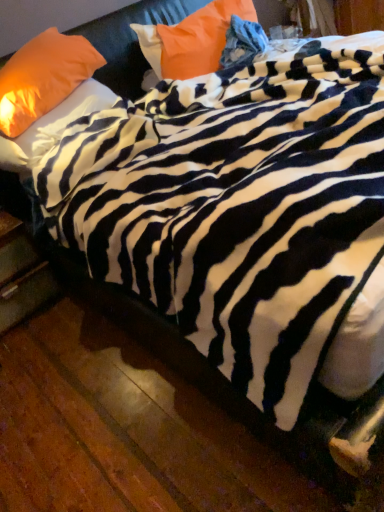
Question: Can you confirm if orange fabric pillow at upper left, the 1th pillow viewed from the left, is shorter than matte orange pillow at upper left, marked as the second pillow in a left-to-right arrangement?

Choices:
 (A) yes
 (B) no

Answer: (B)

Question: From a real-world perspective, is orange fabric pillow at upper left, the 1th pillow viewed from the left, physically below matte orange pillow at upper left, which is the 2th pillow from right to left?

Choices:
 (A) yes
 (B) no

Answer: (B)

Question: Considering the relative positions of orange fabric pillow at upper left, which is counted as the third pillow, starting from the right, and matte orange pillow at upper left, marked as the second pillow in a left-to-right arrangement, in the image provided, is orange fabric pillow at upper left, which is counted as the third pillow, starting from the right, to the right of matte orange pillow at upper left, marked as the second pillow in a left-to-right arrangement, from the viewer's perspective?

Choices:
 (A) no
 (B) yes

Answer: (A)

Question: Does orange fabric pillow at upper left, which is counted as the third pillow, starting from the right, have a larger size compared to matte orange pillow at upper left, which is the 2th pillow from right to left?

Choices:
 (A) yes
 (B) no

Answer: (A)

Question: Is orange fabric pillow at upper left, the 1th pillow viewed from the left, thinner than matte orange pillow at upper left, marked as the second pillow in a left-to-right arrangement?

Choices:
 (A) yes
 (B) no

Answer: (A)

Question: Is point (24, 121) closer or farther from the camera than point (33, 136)?

Choices:
 (A) farther
 (B) closer

Answer: (B)

Question: Looking at the image, does orange fabric pillow at upper left, which is counted as the third pillow, starting from the right, seem bigger or smaller compared to matte orange pillow at upper left, which is the 2th pillow from right to left?

Choices:
 (A) big
 (B) small

Answer: (A)

Question: Is orange fabric pillow at upper left, which is counted as the third pillow, starting from the right, wider or thinner than matte orange pillow at upper left, which is the 2th pillow from right to left?

Choices:
 (A) thin
 (B) wide

Answer: (A)

Question: Relative to matte orange pillow at upper left, marked as the second pillow in a left-to-right arrangement, is orange fabric pillow at upper left, the 1th pillow viewed from the left, in front or behind?

Choices:
 (A) front
 (B) behind

Answer: (A)

Question: Is point (23, 155) closer or farther from the camera than point (31, 50)?

Choices:
 (A) farther
 (B) closer

Answer: (B)

Question: Considering the positions of matte orange pillow at upper left, marked as the second pillow in a left-to-right arrangement, and orange fabric pillow at upper left, the 1th pillow viewed from the left, in the image, is matte orange pillow at upper left, marked as the second pillow in a left-to-right arrangement, taller or shorter than orange fabric pillow at upper left, the 1th pillow viewed from the left,?

Choices:
 (A) short
 (B) tall

Answer: (A)

Question: From the image's perspective, relative to orange fabric pillow at upper left, which is counted as the third pillow, starting from the right, is matte orange pillow at upper left, which is the 2th pillow from right to left, above or below?

Choices:
 (A) below
 (B) above

Answer: (A)

Question: Based on their sizes in the image, would you say matte orange pillow at upper left, which is the 2th pillow from right to left, is bigger or smaller than orange fabric pillow at upper left, the 1th pillow viewed from the left?

Choices:
 (A) big
 (B) small

Answer: (B)

Question: Considering the positions of wooden drawer at lower left and orange fabric pillow at upper left, which is counted as the third pillow, starting from the right, in the image, is wooden drawer at lower left wider or thinner than orange fabric pillow at upper left, which is counted as the third pillow, starting from the right,?

Choices:
 (A) thin
 (B) wide

Answer: (B)

Question: Considering the relative positions of wooden drawer at lower left and orange fabric pillow at upper left, the 1th pillow viewed from the left, in the image provided, is wooden drawer at lower left to the left or to the right of orange fabric pillow at upper left, the 1th pillow viewed from the left,?

Choices:
 (A) left
 (B) right

Answer: (A)